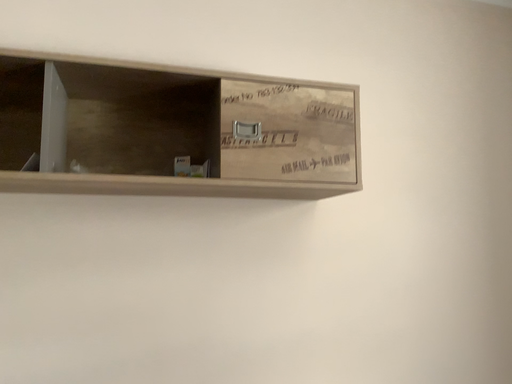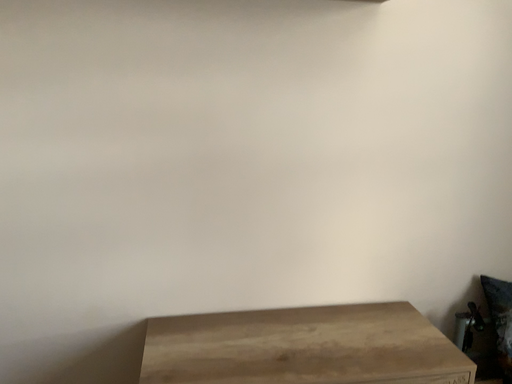
Question: Which way did the camera rotate in the video?

Choices:
 (A) rotated upward
 (B) rotated downward

Answer: (B)